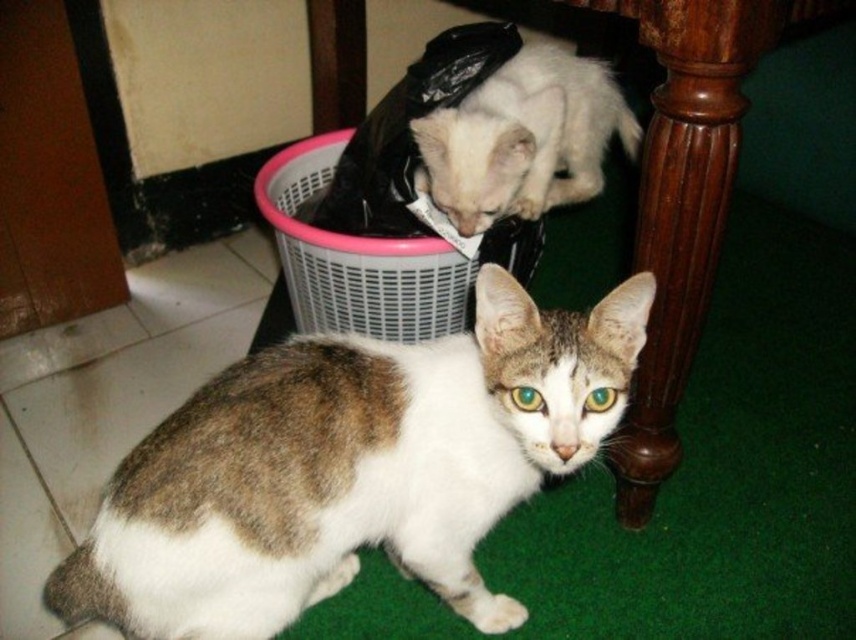
Can you confirm if brown and white fur cat at lower center is shorter than wooden at lower center?

Yes.

Which is above, brown and white fur cat at lower center or wooden at lower center?

wooden at lower center is above.

Image resolution: width=856 pixels, height=640 pixels. I want to click on brown and white fur cat at lower center, so click(x=351, y=467).

The width and height of the screenshot is (856, 640). Identify the location of brown and white fur cat at lower center. (351, 467).

Which is more to the right, white matte plastic bag at upper center or pink plastic basket at upper center?

From the viewer's perspective, white matte plastic bag at upper center appears more on the right side.

From the picture: Is white matte plastic bag at upper center below pink plastic basket at upper center?

No, white matte plastic bag at upper center is not below pink plastic basket at upper center.

Locate an element on the screen. Image resolution: width=856 pixels, height=640 pixels. white matte plastic bag at upper center is located at coordinates (522, 138).

Can you confirm if wooden at lower center is positioned above white matte plastic bag at upper center?

No, wooden at lower center is not above white matte plastic bag at upper center.

Who is positioned more to the right, wooden at lower center or white matte plastic bag at upper center?

Positioned to the right is wooden at lower center.

You are a GUI agent. You are given a task and a screenshot of the screen. Output one action in this format:
    pyautogui.click(x=<x>, y=<y>)
    Task: Click on the wooden at lower center
    Image resolution: width=856 pixels, height=640 pixels.
    Given the screenshot: What is the action you would take?
    pyautogui.click(x=682, y=205)

Locate an element on the screen. Image resolution: width=856 pixels, height=640 pixels. wooden at lower center is located at coordinates (682, 205).